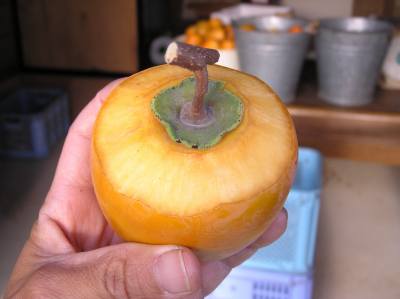
Find the location of a particular element. Image resolution: width=400 pixels, height=299 pixels. bucket is located at coordinates (286, 57), (327, 59).